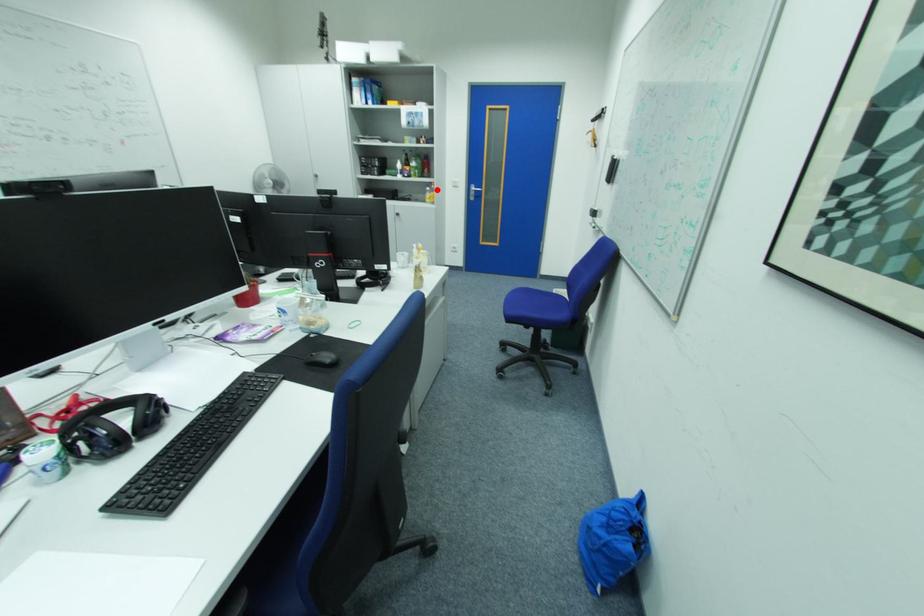
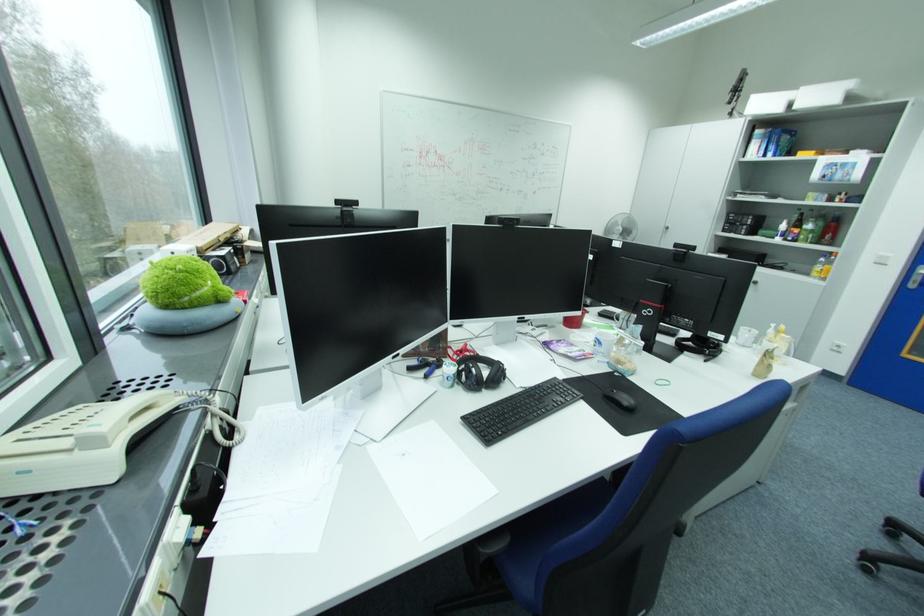
The point at the highlighted location is marked in the first image. Where is the corresponding point in the second image?

(832, 260)